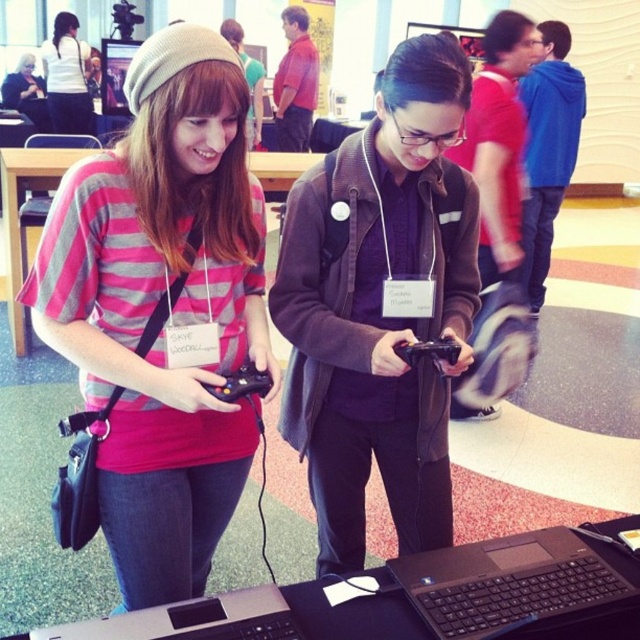
You are a photographer at the gaming event and need to take a photo of the dark brown jacket at center and the black matte laptop at lower center. Which object is located to the left of the other?

The dark brown jacket at center is positioned on the left side of black matte laptop at lower center, so the dark brown jacket at center is to the left of the black matte laptop at lower center.

You are standing in the middle of the gaming event and see the matte pink striped shirt at center. Can you estimate its exact coordinates based on the room layout?

The coordinates of the matte pink striped shirt at center are at point [170,308].

You are a photographer at the event and need to capture a photo that includes both the matte pink striped shirt at center and the black matte laptop at lower center. Based on their positions, will the laptop be visible in the shot if you focus on the shirt?

The matte pink striped shirt at center is located above the black matte laptop at lower center, so if you focus on the shirt, the laptop should still be visible in the shot as it is positioned below the shirt.